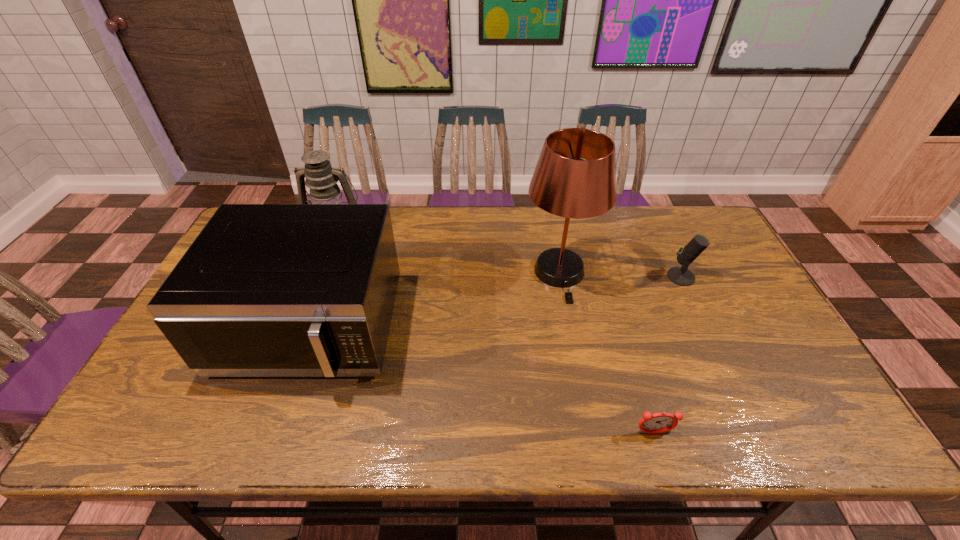
Choose which object is the second nearest neighbor to the lampshade. Please provide its 2D coordinates. Your answer should be formatted as a tuple, i.e. [(x, y)], where the tuple contains the x and y coordinates of a point satisfying the conditions above.

[(265, 290)]

Identify which object is the third closest to the lampshade. Please provide its 2D coordinates. Your answer should be formatted as a tuple, i.e. [(x, y)], where the tuple contains the x and y coordinates of a point satisfying the conditions above.

[(656, 423)]